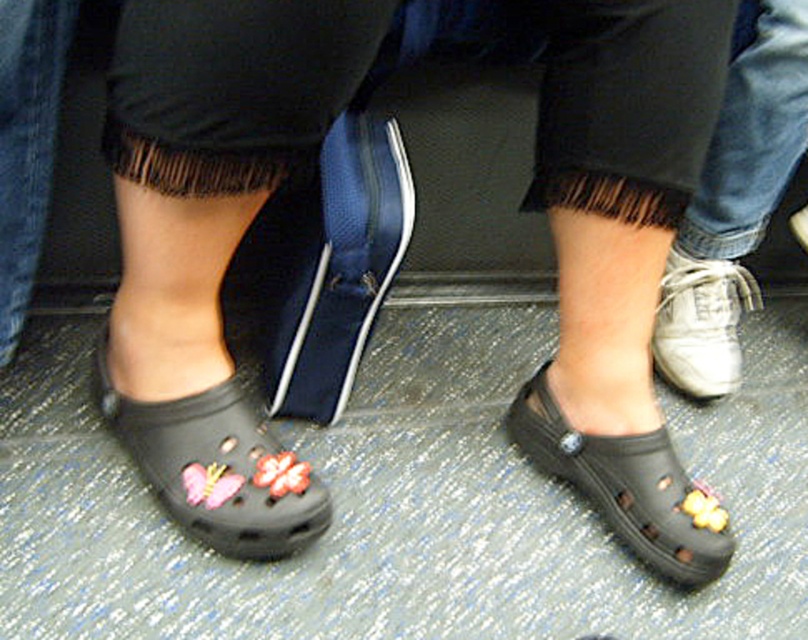
Question: Is black rubber clog at lower center to the right of white leather sneaker at right from the viewer's perspective?

Choices:
 (A) yes
 (B) no

Answer: (B)

Question: Does white leather shoe at lower right lie in front of white leather sneaker at right?

Choices:
 (A) no
 (B) yes

Answer: (B)

Question: Which of the following is the closest to the observer?

Choices:
 (A) matte black croc at lower left
 (B) black rubber clog at lower center
 (C) white leather shoe at lower right
 (D) white leather sneaker at right

Answer: (A)

Question: Which point is closer to the camera?

Choices:
 (A) (104, 356)
 (B) (730, 385)
 (C) (629, 449)
 (D) (739, 368)

Answer: (A)

Question: Which point appears farthest from the camera in this image?

Choices:
 (A) (705, 257)
 (B) (103, 358)
 (C) (689, 260)
 (D) (718, 557)

Answer: (C)

Question: Is matte black croc at lower left wider than black rubber clog at lower center?

Choices:
 (A) no
 (B) yes

Answer: (B)